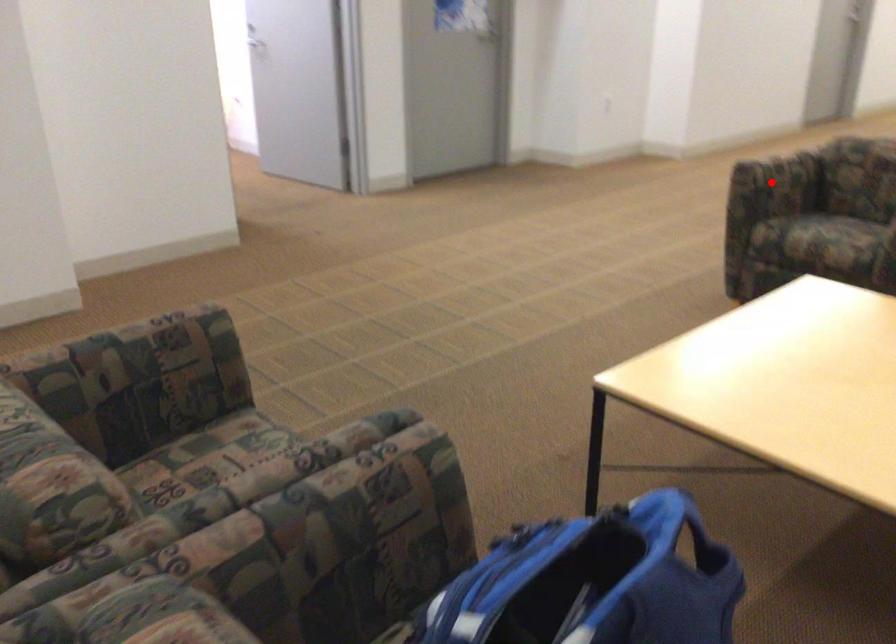
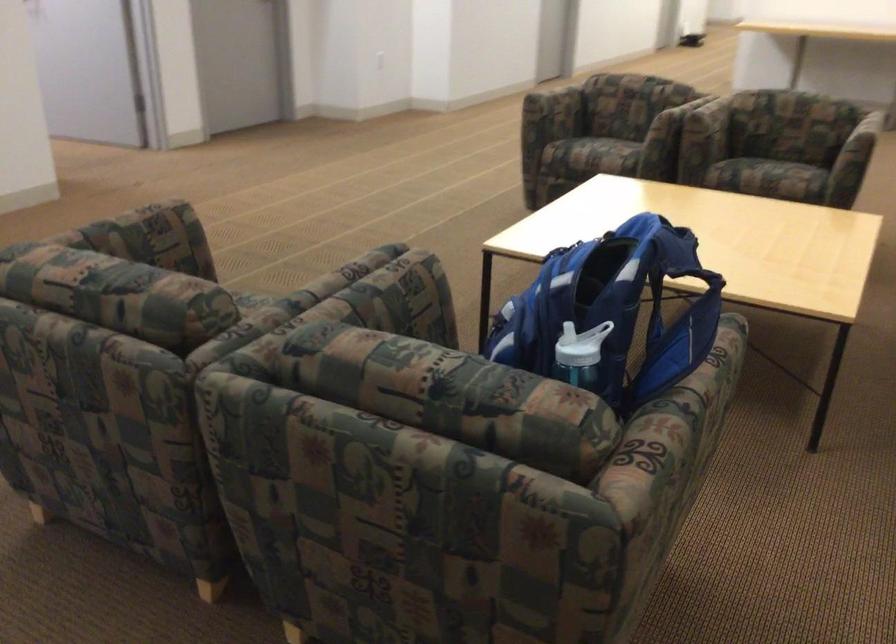
Question: I am providing you with two images of the same scene from different viewpoints. A red point is marked on the first image. Can you still see the location of the red point in image 2?

Choices:
 (A) Yes
 (B) No

Answer: (A)